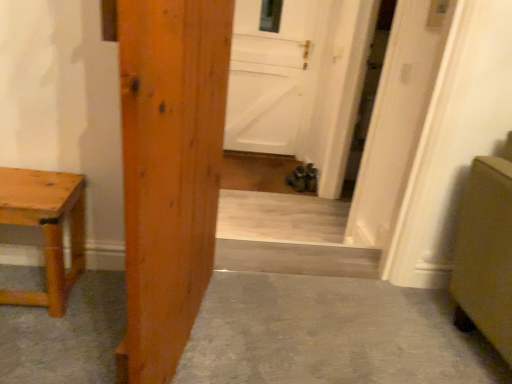
In order to face white matte door at center, placed as the 1th door when sorted from right to left, should I rotate leftwards or rightwards?

Rotate your view right by about 14.133°.

Image resolution: width=512 pixels, height=384 pixels. What do you see at coordinates (46, 228) in the screenshot?
I see `natural wood table at left` at bounding box center [46, 228].

The height and width of the screenshot is (384, 512). What do you see at coordinates (330, 335) in the screenshot? I see `smooth concrete floor at center` at bounding box center [330, 335].

Where is `white matte door at center, placed as the 1th door when sorted from right to left`? The height and width of the screenshot is (384, 512). white matte door at center, placed as the 1th door when sorted from right to left is located at coordinates (397, 118).

Is natural wood table at left oriented towards smooth concrete floor at center?

No, natural wood table at left does not turn towards smooth concrete floor at center.

Considering the relative sizes of natural wood table at left and smooth concrete floor at center in the image provided, is natural wood table at left shorter than smooth concrete floor at center?

In fact, natural wood table at left may be taller than smooth concrete floor at center.

In terms of width, does natural wood table at left look wider or thinner when compared to smooth concrete floor at center?

natural wood table at left is thinner than smooth concrete floor at center.

Is point (82, 223) behind point (350, 314)?

Yes, it is.

Which object is closer to the camera taking this photo, smooth concrete floor at center or white matte door at center, marked as the 2th door in a front-to-back arrangement?

smooth concrete floor at center is closer to the camera.

In the scene shown: Between smooth concrete floor at center and white matte door at center, the 3th door viewed from the left, which one has more height?

white matte door at center, the 3th door viewed from the left.

Is white matte door at center, placed as the 1th door when sorted from right to left, at the back of smooth concrete floor at center?

No, smooth concrete floor at center's orientation is not away from white matte door at center, placed as the 1th door when sorted from right to left.

Does point (258, 342) appear closer or farther from the camera than point (419, 118)?

Point (258, 342) is positioned closer to the camera compared to point (419, 118).

Can you confirm if wooden door at center, which ranks as the first door in front-to-back order, is wider than white matte door at center, marked as the 2th door in a front-to-back arrangement?

Incorrect, the width of wooden door at center, which ranks as the first door in front-to-back order, does not surpass that of white matte door at center, marked as the 2th door in a front-to-back arrangement.

Looking at the image, does wooden door at center, which ranks as the first door in front-to-back order, seem bigger or smaller compared to white matte door at center, the 2th door from the back?

In the image, wooden door at center, which ranks as the first door in front-to-back order, appears to be smaller than white matte door at center, the 2th door from the back.

Can you confirm if wooden door at center, marked as the third door in a right-to-left arrangement, is positioned to the right of white matte door at center, marked as the 2th door in a front-to-back arrangement?

Incorrect, wooden door at center, marked as the third door in a right-to-left arrangement, is not on the right side of white matte door at center, marked as the 2th door in a front-to-back arrangement.

How different are the orientations of wooden door at center, acting as the first door starting from the left, and white matte door at center, placed as the 1th door when sorted from right to left, in degrees?

wooden door at center, acting as the first door starting from the left, and white matte door at center, placed as the 1th door when sorted from right to left, are facing 168 degrees away from each other.

In terms of width, does smooth concrete floor at center look wider or thinner when compared to white matte door at center, which is the 2th door in right-to-left order?

Considering their sizes, smooth concrete floor at center looks broader than white matte door at center, which is the 2th door in right-to-left order.

Can you see smooth concrete floor at center touching white matte door at center, which is the 2th door from left to right?

smooth concrete floor at center and white matte door at center, which is the 2th door from left to right, are not in contact.

Does point (79, 348) lie in front of point (238, 21)?

Yes, point (79, 348) is closer to viewer.

From a real-world perspective, is smooth concrete floor at center below white matte door at center, which is the 2th door from left to right?

Indeed, from a real-world perspective, smooth concrete floor at center is positioned beneath white matte door at center, which is the 2th door from left to right.

Does white matte door at center, placed as the third door when sorted from front to back, lie in front of wooden door at center, which appears as the 3th door when viewed from the back?

That is False.

Who is taller, white matte door at center, placed as the third door when sorted from front to back, or wooden door at center, acting as the first door starting from the left?

Standing taller between the two is white matte door at center, placed as the third door when sorted from front to back.

Where is `door that is the 2nd one when counting downward from the white matte door at center, marked as the first door in a back-to-front arrangement (from the image's perspective)`? Image resolution: width=512 pixels, height=384 pixels. door that is the 2nd one when counting downward from the white matte door at center, marked as the first door in a back-to-front arrangement (from the image's perspective) is located at coordinates (169, 171).

Is white matte door at center, which is the 2th door from left to right, to the left or to the right of wooden door at center, which ranks as the first door in front-to-back order, in the image?

white matte door at center, which is the 2th door from left to right, is to the right of wooden door at center, which ranks as the first door in front-to-back order.

Between smooth concrete floor at center and wooden door at center, acting as the first door starting from the left, which one is positioned behind?

smooth concrete floor at center is further from the camera.

Are smooth concrete floor at center and wooden door at center, which appears as the 3th door when viewed from the back, beside each other?

No, smooth concrete floor at center is not touching wooden door at center, which appears as the 3th door when viewed from the back.

From a real-world perspective, who is located lower, smooth concrete floor at center or wooden door at center, marked as the third door in a right-to-left arrangement?

In real-world perspective, smooth concrete floor at center is lower.

How far apart are white matte door at center, which is the 2th door in right-to-left order, and white matte door at center, the 3th door viewed from the left?

A distance of 6.09 feet exists between white matte door at center, which is the 2th door in right-to-left order, and white matte door at center, the 3th door viewed from the left.

Can you confirm if white matte door at center, which is the 2th door from left to right, is shorter than white matte door at center, the 2th door from the back?

Yes.

Locate an element on the screen. The height and width of the screenshot is (384, 512). door that appears on the right of white matte door at center, marked as the first door in a back-to-front arrangement is located at coordinates (397, 118).

Which object is more forward, white matte door at center, placed as the third door when sorted from front to back, or white matte door at center, the 3th door viewed from the left?

white matte door at center, the 3th door viewed from the left, is closer to the camera.

Where is `concrete on the right of natural wood table at left`? Image resolution: width=512 pixels, height=384 pixels. concrete on the right of natural wood table at left is located at coordinates (330, 335).

In the image, there is a white matte door at center, the 2th door from the back. Identify the location of concrete below it (from the image's perspective). (330, 335).

When comparing their distances from natural wood table at left, does wooden door at center, acting as the first door starting from the left, or white matte door at center, the 2th door from the back, seem further?

white matte door at center, the 2th door from the back, is further to natural wood table at left.

Which object lies further to the anchor point white matte door at center, placed as the third door when sorted from front to back, wooden door at center, which ranks as the first door in front-to-back order, or smooth concrete floor at center?

The object further to white matte door at center, placed as the third door when sorted from front to back, is wooden door at center, which ranks as the first door in front-to-back order.

In the scene shown: From the image, which object appears to be nearer to white matte door at center, the 2th door from the back, white matte door at center, placed as the third door when sorted from front to back, or smooth concrete floor at center?

Based on the image, smooth concrete floor at center appears to be nearer to white matte door at center, the 2th door from the back.

Which object lies nearer to the anchor point smooth concrete floor at center, white matte door at center, which is the 2th door in right-to-left order, or wooden door at center, acting as the first door starting from the left?

Based on the image, wooden door at center, acting as the first door starting from the left, appears to be nearer to smooth concrete floor at center.

Based on the photo, when comparing their distances from smooth concrete floor at center, does wooden door at center, which ranks as the first door in front-to-back order, or white matte door at center, which is the 2th door from left to right, seem closer?

wooden door at center, which ranks as the first door in front-to-back order, is closer to smooth concrete floor at center.

Considering their positions, is white matte door at center, the 3th door viewed from the left, positioned further to smooth concrete floor at center than wooden door at center, acting as the first door starting from the left?

Among the two, white matte door at center, the 3th door viewed from the left, is located further to smooth concrete floor at center.

Consider the image. Which object lies nearer to the anchor point natural wood table at left, white matte door at center, the 2th door from the back, or smooth concrete floor at center?

Based on the image, smooth concrete floor at center appears to be nearer to natural wood table at left.

Which object lies nearer to the anchor point white matte door at center, marked as the first door in a back-to-front arrangement, white matte door at center, marked as the 2th door in a front-to-back arrangement, or natural wood table at left?

white matte door at center, marked as the 2th door in a front-to-back arrangement, is positioned closer to the anchor white matte door at center, marked as the first door in a back-to-front arrangement.

This screenshot has height=384, width=512. Identify the location of table positioned between smooth concrete floor at center and white matte door at center, placed as the third door when sorted from front to back, from near to far. (46, 228).

I want to click on door between natural wood table at left and white matte door at center, which is the 2th door in right-to-left order, from front to back, so click(397, 118).

The image size is (512, 384). Identify the location of concrete between wooden door at center, which appears as the 3th door when viewed from the back, and white matte door at center, the 3th door viewed from the left, from front to back. (330, 335).

The height and width of the screenshot is (384, 512). What are the coordinates of `table between wooden door at center, which ranks as the first door in front-to-back order, and white matte door at center, the 2th door from the back, along the z-axis` in the screenshot? It's located at (46, 228).